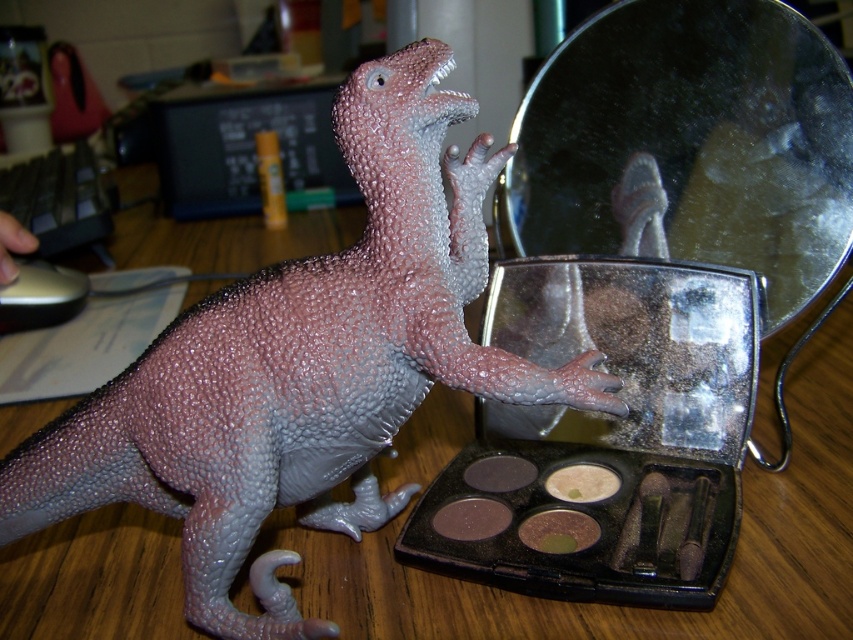
Question: Which point is closer to the camera?

Choices:
 (A) matte beige powder at center
 (B) brown matte powder at center
 (C) metallic reflective mirror at center
 (D) matte brown powder at center

Answer: (B)

Question: Is brown matte powder at center to the right of matte brown powder at lower center from the viewer's perspective?

Choices:
 (A) no
 (B) yes

Answer: (B)

Question: Estimate the real-world distances between objects in this image. Which object is farther from the matte beige powder at center?

Choices:
 (A) metallic reflective mirror at center
 (B) matte brown powder at center
 (C) brown matte powder at center

Answer: (A)

Question: Does matte brown powder at lower center appear on the left side of matte brown powder at center?

Choices:
 (A) yes
 (B) no

Answer: (A)

Question: Which of the following is the closest to the observer?

Choices:
 (A) brown matte powder at center
 (B) matte beige powder at center

Answer: (A)

Question: Considering the relative positions of matte pink dinosaur at center and metallic reflective mirror at center in the image provided, where is matte pink dinosaur at center located with respect to metallic reflective mirror at center?

Choices:
 (A) below
 (B) above

Answer: (A)